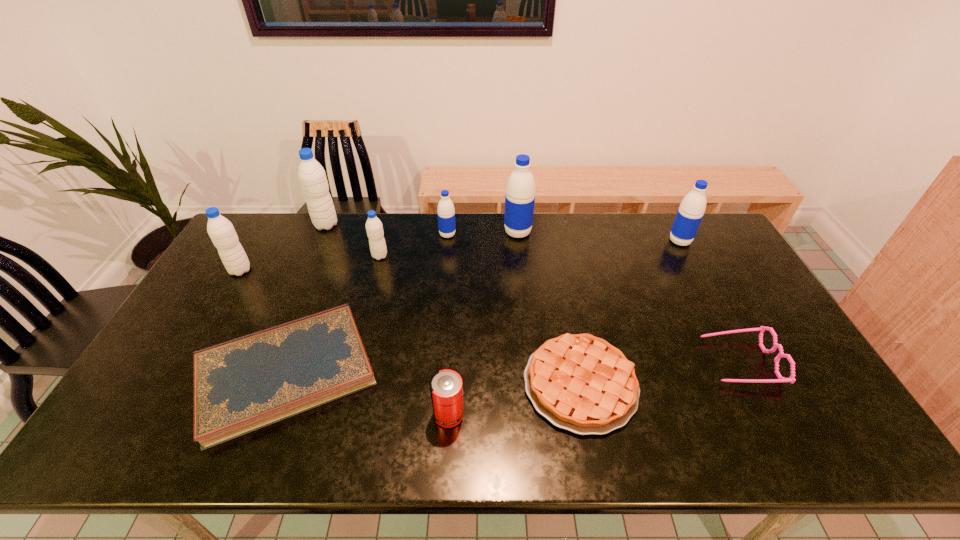
Find the location of a particular element. This screenshot has height=540, width=960. free space between the paperback book and the biggest gray water bottle is located at coordinates (306, 299).

Where is `object that stands as the sixth closest to the biggest blue water bottle`? The height and width of the screenshot is (540, 960). object that stands as the sixth closest to the biggest blue water bottle is located at coordinates (791, 379).

Where is `object that is the eighth closest to the seventh tallest object`? This screenshot has width=960, height=540. object that is the eighth closest to the seventh tallest object is located at coordinates (312, 177).

Image resolution: width=960 pixels, height=540 pixels. Identify the location of water bottle that is the fifth closest one to the pie. (312, 177).

Where is `water bottle that is the fourth nearest to the second smallest blue water bottle`? water bottle that is the fourth nearest to the second smallest blue water bottle is located at coordinates (312, 177).

I want to click on gray water bottle identified as the second closest to the fourth shortest object, so click(x=221, y=231).

Identify which gray water bottle is the nearest to the rightmost gray water bottle. Please provide its 2D coordinates. Your answer should be formatted as a tuple, i.e. [(x, y)], where the tuple contains the x and y coordinates of a point satisfying the conditions above.

[(312, 177)]

Choose which blue water bottle is the nearest neighbor to the leftmost gray water bottle. Please provide its 2D coordinates. Your answer should be formatted as a tuple, i.e. [(x, y)], where the tuple contains the x and y coordinates of a point satisfying the conditions above.

[(446, 213)]

Identify which blue water bottle is the third closest to the second nearest gray water bottle. Please provide its 2D coordinates. Your answer should be formatted as a tuple, i.e. [(x, y)], where the tuple contains the x and y coordinates of a point satisfying the conditions above.

[(691, 211)]

Where is `vacant region that satisfies the following two spatial constraints: 1. on the back side of the rightmost gray water bottle; 2. on the left side of the fifth nearest object`? vacant region that satisfies the following two spatial constraints: 1. on the back side of the rightmost gray water bottle; 2. on the left side of the fifth nearest object is located at coordinates (249, 256).